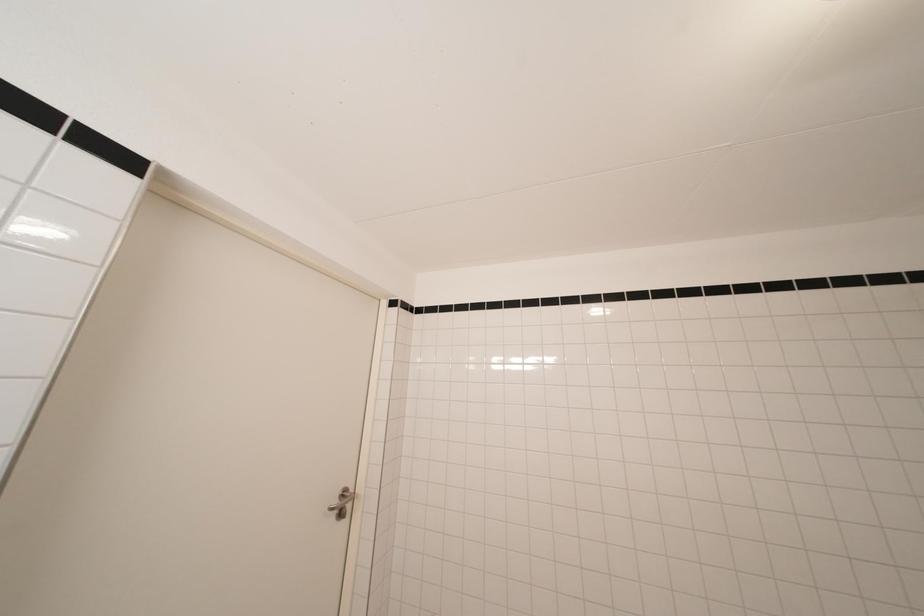
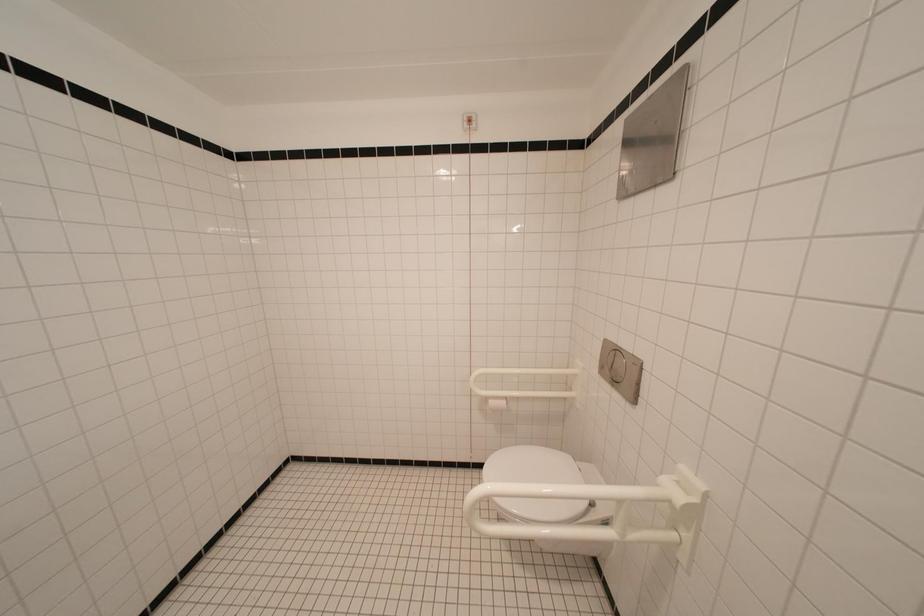
Question: The first image is from the beginning of the video and the second image is from the end. How did the camera likely rotate when shooting the video?

Choices:
 (A) Left
 (B) Right
 (C) Up
 (D) Down

Answer: (B)